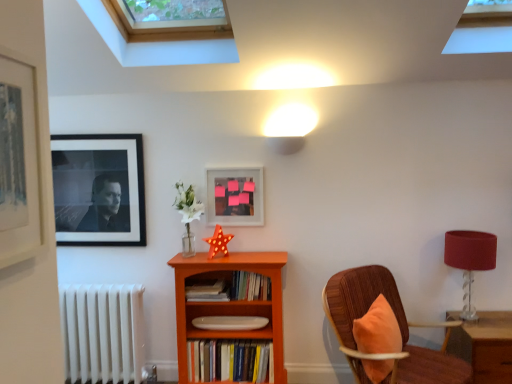
Question: Considering the relative sizes of orange wood bookcase at center and matte black picture frame at upper left, arranged as the third picture frame when viewed from the front, in the image provided, is orange wood bookcase at center bigger than matte black picture frame at upper left, arranged as the third picture frame when viewed from the front,?

Choices:
 (A) yes
 (B) no

Answer: (A)

Question: Does orange wood bookcase at center lie in front of matte black picture frame at upper left, arranged as the third picture frame when viewed from the front?

Choices:
 (A) yes
 (B) no

Answer: (A)

Question: From the image's perspective, is orange wood bookcase at center on top of matte black picture frame at upper left, the first picture frame from the back?

Choices:
 (A) no
 (B) yes

Answer: (A)

Question: Considering the relative sizes of orange wood bookcase at center and matte black picture frame at upper left, which is counted as the first picture frame, starting from the left, in the image provided, is orange wood bookcase at center wider than matte black picture frame at upper left, which is counted as the first picture frame, starting from the left,?

Choices:
 (A) no
 (B) yes

Answer: (B)

Question: Can you confirm if orange wood bookcase at center is positioned to the right of matte black picture frame at upper left, which is counted as the 3th picture frame, starting from the right?

Choices:
 (A) yes
 (B) no

Answer: (A)

Question: Is orange wood bookcase at center completely or partially outside of matte black picture frame at upper left, the first picture frame from the back?

Choices:
 (A) no
 (B) yes

Answer: (B)

Question: Can you confirm if matte glass picture frame at center, which appears as the second picture frame when viewed from the front, is positioned to the left of white matte plate at center, the 3th book in the top-to-bottom sequence?

Choices:
 (A) yes
 (B) no

Answer: (B)

Question: Would you say white matte plate at center, which is counted as the first book, starting from the bottom, is part of matte glass picture frame at center, which is counted as the first picture frame, starting from the right,'s contents?

Choices:
 (A) yes
 (B) no

Answer: (B)

Question: Is matte glass picture frame at center, arranged as the 3th picture frame when viewed from the left, next to white matte plate at center, the 3th book in the top-to-bottom sequence?

Choices:
 (A) yes
 (B) no

Answer: (B)

Question: Is matte glass picture frame at center, arranged as the 3th picture frame when viewed from the left, not within white matte plate at center, the 3th book in the top-to-bottom sequence?

Choices:
 (A) yes
 (B) no

Answer: (A)

Question: Is matte glass picture frame at center, arranged as the 3th picture frame when viewed from the left, taller than white matte plate at center, which is counted as the first book, starting from the bottom?

Choices:
 (A) yes
 (B) no

Answer: (A)

Question: From a real-world perspective, is matte glass picture frame at center, which appears as the second picture frame when viewed from the front, under white matte plate at center, the 3th book in the top-to-bottom sequence?

Choices:
 (A) yes
 (B) no

Answer: (B)

Question: Is white metallic radiator at lower left aimed at orange wood bookcase at center?

Choices:
 (A) no
 (B) yes

Answer: (A)